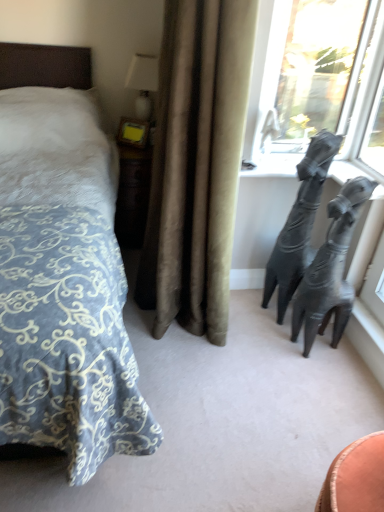
Question: Is black matte giraffe at right next to shiny metallic sculpture at right and touching it?

Choices:
 (A) yes
 (B) no

Answer: (B)

Question: Can you confirm if black matte giraffe at right is thinner than shiny metallic sculpture at right?

Choices:
 (A) no
 (B) yes

Answer: (A)

Question: Could you tell me if black matte giraffe at right is facing shiny metallic sculpture at right?

Choices:
 (A) no
 (B) yes

Answer: (A)

Question: Is black matte giraffe at right further to camera compared to shiny metallic sculpture at right?

Choices:
 (A) no
 (B) yes

Answer: (B)

Question: From the image's perspective, would you say black matte giraffe at right is shown under shiny metallic sculpture at right?

Choices:
 (A) no
 (B) yes

Answer: (A)

Question: Can you confirm if black matte giraffe at right is shorter than shiny metallic sculpture at right?

Choices:
 (A) yes
 (B) no

Answer: (B)

Question: Is shiny metallic sculpture at right smaller than white glossy table lamp at upper center?

Choices:
 (A) yes
 (B) no

Answer: (B)

Question: From the image's perspective, is shiny metallic sculpture at right above white glossy table lamp at upper center?

Choices:
 (A) no
 (B) yes

Answer: (A)

Question: Is shiny metallic sculpture at right at the right side of white glossy table lamp at upper center?

Choices:
 (A) no
 (B) yes

Answer: (B)

Question: Considering the relative positions of shiny metallic sculpture at right and white glossy table lamp at upper center in the image provided, is shiny metallic sculpture at right behind white glossy table lamp at upper center?

Choices:
 (A) yes
 (B) no

Answer: (B)

Question: Could you tell me if shiny metallic sculpture at right is turned towards white glossy table lamp at upper center?

Choices:
 (A) yes
 (B) no

Answer: (B)

Question: Can you confirm if shiny metallic sculpture at right is shorter than white glossy table lamp at upper center?

Choices:
 (A) yes
 (B) no

Answer: (B)

Question: Does shiny metallic sculpture at right have a larger size compared to transparent glass window at upper right?

Choices:
 (A) yes
 (B) no

Answer: (A)